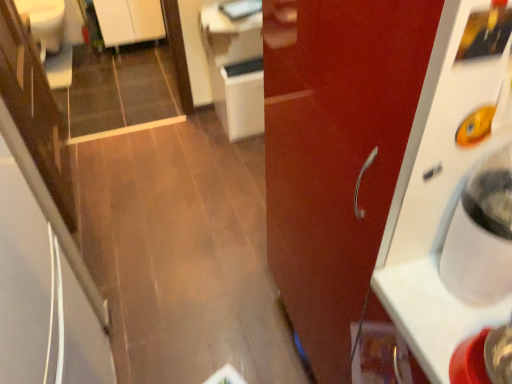
Question: Is white glossy counter top at upper center positioned beyond the bounds of white glossy cabinet at upper left, which is the 2th cabinetry from right to left?

Choices:
 (A) yes
 (B) no

Answer: (A)

Question: Can you confirm if white glossy counter top at upper center is wider than white glossy cabinet at upper left, marked as the 1th cabinetry in a back-to-front arrangement?

Choices:
 (A) no
 (B) yes

Answer: (B)

Question: Would you say white glossy counter top at upper center contains white glossy cabinet at upper left, which is the first cabinetry in top-to-bottom order?

Choices:
 (A) no
 (B) yes

Answer: (A)

Question: Is white glossy counter top at upper center shorter than white glossy cabinet at upper left, which is the 2th cabinetry from right to left?

Choices:
 (A) yes
 (B) no

Answer: (A)

Question: Could you tell me if white glossy counter top at upper center is turned towards white glossy cabinet at upper left, marked as the 1th cabinetry in a back-to-front arrangement?

Choices:
 (A) no
 (B) yes

Answer: (A)

Question: Does white glossy counter top at upper center have a larger size compared to white glossy cabinet at upper left, which is the 2th cabinetry from right to left?

Choices:
 (A) no
 (B) yes

Answer: (A)

Question: Can you confirm if white glossy cabinet at center, arranged as the second cabinetry when viewed from the top, is thinner than white glossy counter top at upper center?

Choices:
 (A) no
 (B) yes

Answer: (A)

Question: Can you confirm if white glossy cabinet at center, which is the 1th cabinetry in right-to-left order, is bigger than white glossy counter top at upper center?

Choices:
 (A) yes
 (B) no

Answer: (A)

Question: From a real-world perspective, is white glossy cabinet at center, which is the 1th cabinetry in right-to-left order, physically below white glossy counter top at upper center?

Choices:
 (A) no
 (B) yes

Answer: (B)

Question: Is white glossy counter top at upper center inside white glossy cabinet at center, arranged as the second cabinetry when viewed from the top?

Choices:
 (A) no
 (B) yes

Answer: (A)

Question: Considering the relative sizes of white glossy cabinet at center, which is the 1th cabinetry in right-to-left order, and white glossy counter top at upper center in the image provided, is white glossy cabinet at center, which is the 1th cabinetry in right-to-left order, smaller than white glossy counter top at upper center?

Choices:
 (A) no
 (B) yes

Answer: (A)

Question: Is the depth of white glossy cabinet at center, arranged as the second cabinetry when viewed from the back, less than that of white glossy counter top at upper center?

Choices:
 (A) yes
 (B) no

Answer: (B)

Question: Is white glossy counter top at upper center not near glossy wood door at right?

Choices:
 (A) yes
 (B) no

Answer: (A)